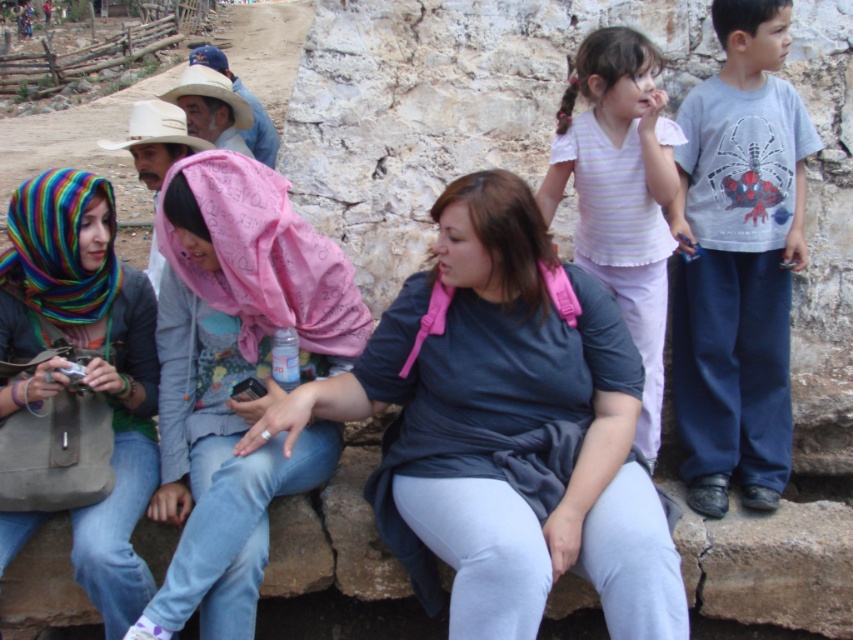
Who is positioned more to the right, pink fabric headscarf at center or striped cotton shirt at upper right?

striped cotton shirt at upper right is more to the right.

Does point (202, 436) lie in front of point (637, 346)?

Yes, it is in front of point (637, 346).

Which is behind, point (171, 464) or point (637, 208)?

Point (637, 208)

The height and width of the screenshot is (640, 853). I want to click on pink fabric headscarf at center, so click(236, 376).

Is matte gray shirt at center thinner than multicolored knitted scarf at left?

No.

Can you confirm if matte gray shirt at center is taller than multicolored knitted scarf at left?

No.

Which is behind, point (650, 572) or point (57, 288)?

The point (57, 288) is behind.

Locate an element on the screen. The image size is (853, 640). matte gray shirt at center is located at coordinates (506, 429).

Is gray cotton t-shirt at right bigger than multicolored knitted scarf at left?

Actually, gray cotton t-shirt at right might be smaller than multicolored knitted scarf at left.

In the scene shown: Between gray cotton t-shirt at right and multicolored knitted scarf at left, which one is positioned lower?

Positioned lower is multicolored knitted scarf at left.

What do you see at coordinates (738, 260) in the screenshot? I see `gray cotton t-shirt at right` at bounding box center [738, 260].

You are a GUI agent. You are given a task and a screenshot of the screen. Output one action in this format:
    pyautogui.click(x=<x>, y=<y>)
    Task: Click on the gray cotton t-shirt at right
    
    Given the screenshot: What is the action you would take?
    pyautogui.click(x=738, y=260)